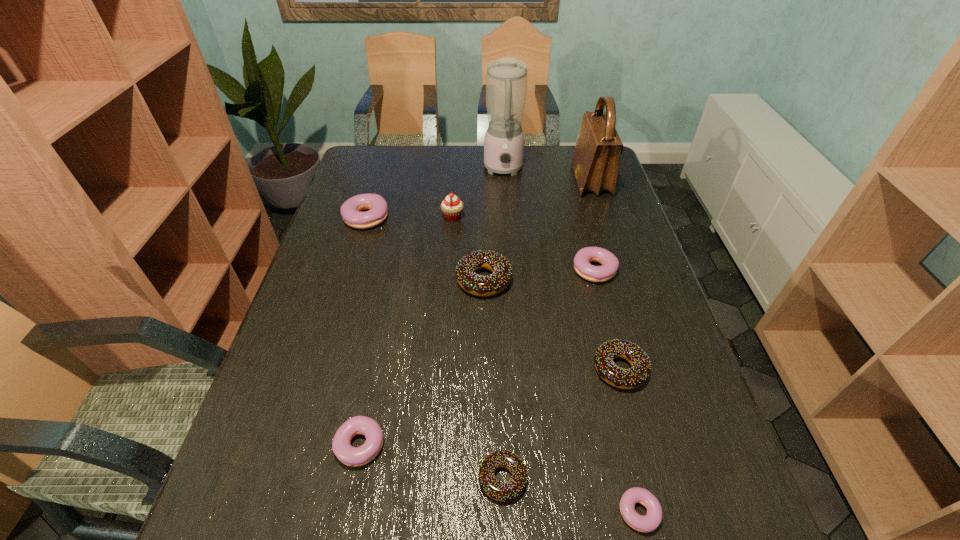
Locate an element on the screen. blank space located on the back of the leftmost purple doughnut is located at coordinates (376, 184).

This screenshot has height=540, width=960. Identify the location of vacant space positioned on the right of the biggest chocolate doughnut. (535, 280).

Where is `free space located on the back of the third smallest purple doughnut`? This screenshot has height=540, width=960. free space located on the back of the third smallest purple doughnut is located at coordinates (582, 222).

Locate an element on the screen. vacant area situated on the left of the fourth nearest doughnut is located at coordinates (454, 369).

Identify the location of vacant space located on the back of the second purple doughnut from left to right. The width and height of the screenshot is (960, 540). (380, 372).

Locate an element on the screen. free location located on the back of the smallest chocolate doughnut is located at coordinates 498,359.

The width and height of the screenshot is (960, 540). Identify the location of free space located 0.330m on the back of the smallest purple doughnut. (598, 337).

At what (x,y) coordinates should I click in order to perform the action: click on food processor situated at the far edge. Please return your answer as a coordinate pair (x, y). This screenshot has width=960, height=540. Looking at the image, I should click on (506, 81).

The height and width of the screenshot is (540, 960). Identify the location of shoulder bag present at the far edge. (595, 162).

Where is `object at the near edge`? The height and width of the screenshot is (540, 960). object at the near edge is located at coordinates (649, 522).